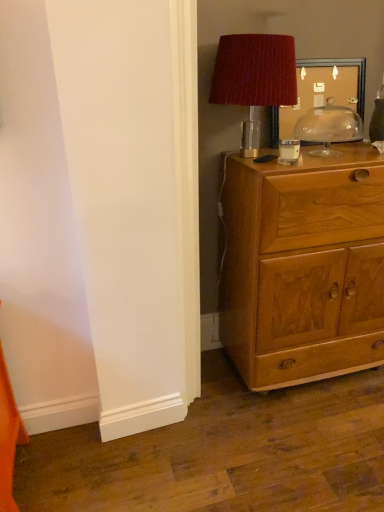
What are the coordinates of `vacant space underneath velvet red lampshade at upper right (from a real-world perspective)` in the screenshot? It's located at (263, 156).